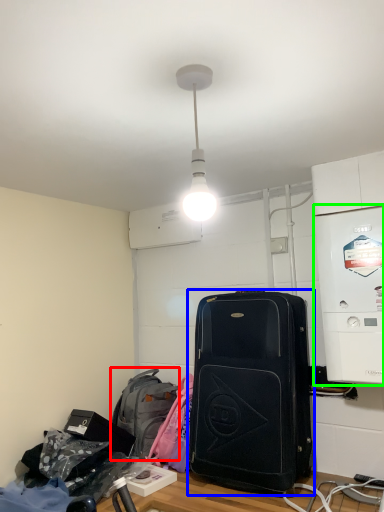
Question: Based on their relative distances, which object is farther from backpack (highlighted by a red box)? Choose from luggage and bags (highlighted by a blue box) and appliance (highlighted by a green box).

Choices:
 (A) luggage and bags
 (B) appliance

Answer: (B)